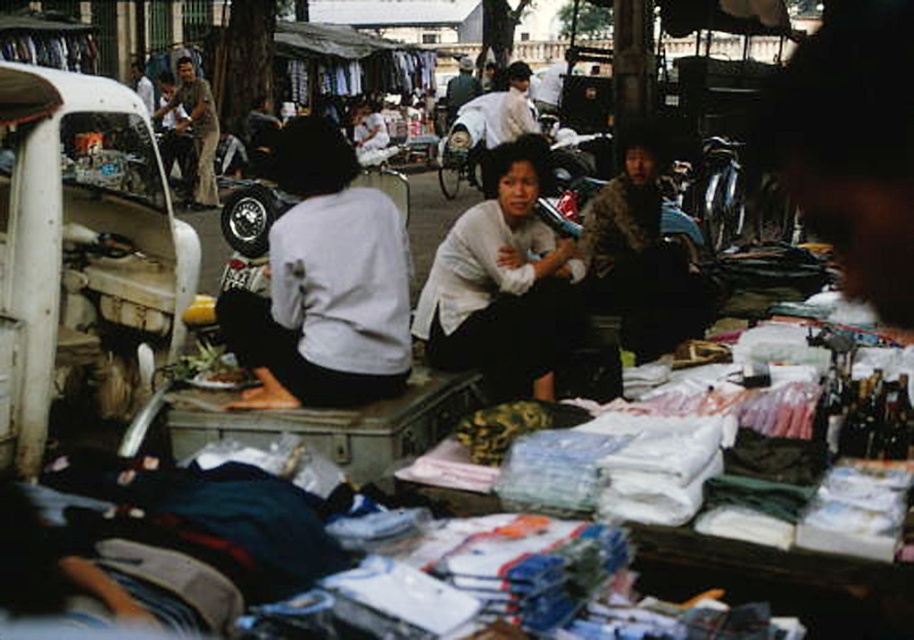
Question: Which point is closer to the camera?

Choices:
 (A) (216, 195)
 (B) (469, 61)
 (C) (444, 324)

Answer: (C)

Question: Does camouflage jacket at center appear on the left side of brown textured shirt at upper left?

Choices:
 (A) yes
 (B) no

Answer: (B)

Question: Can you confirm if white matte sweater at center is positioned below brown textured shirt at upper left?

Choices:
 (A) yes
 (B) no

Answer: (A)

Question: Which of the following is the farthest from the observer?

Choices:
 (A) tap(465, 81)
 (B) tap(443, 355)

Answer: (A)

Question: Which object is the closest to the white matte sweater at center?

Choices:
 (A) camouflage jacket at center
 (B) dark gray fabric jacket at center
 (C) brown textured shirt at upper left

Answer: (A)

Question: Is camouflage jacket at center to the right of dark gray fabric jacket at center from the viewer's perspective?

Choices:
 (A) yes
 (B) no

Answer: (A)